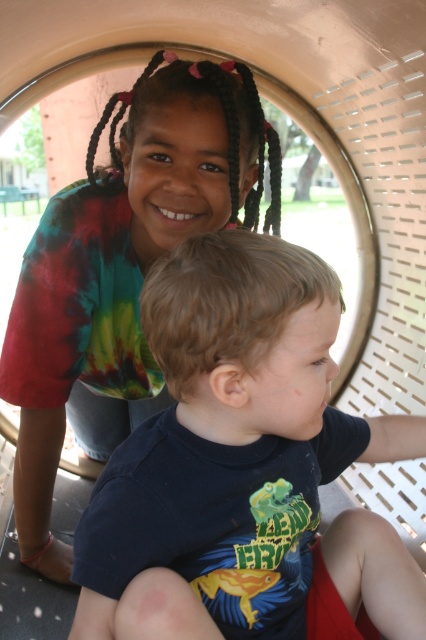
Question: Is dark blue t-shirt at center positioned at the back of matte black hair at upper center?

Choices:
 (A) no
 (B) yes

Answer: (A)

Question: Estimate the real-world distances between objects in this image. Which object is closer to the dark blue t-shirt at center?

Choices:
 (A) matte black hair at upper center
 (B) tie-dye fabric shirt at upper left

Answer: (A)

Question: Does dark blue t-shirt at center have a greater width compared to matte black hair at upper center?

Choices:
 (A) yes
 (B) no

Answer: (A)

Question: Which object appears farthest from the camera in this image?

Choices:
 (A) matte black hair at upper center
 (B) tie-dye fabric shirt at upper left

Answer: (B)

Question: Can you confirm if dark blue t-shirt at center is thinner than matte black hair at upper center?

Choices:
 (A) no
 (B) yes

Answer: (A)

Question: Which is farther from the matte black hair at upper center?

Choices:
 (A) dark blue t-shirt at center
 (B) tie-dye fabric shirt at upper left

Answer: (A)